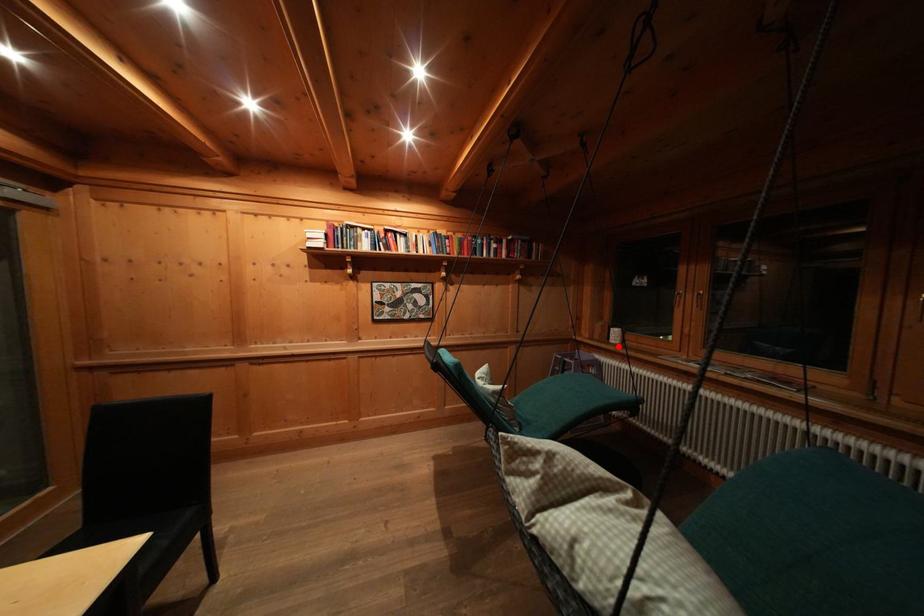
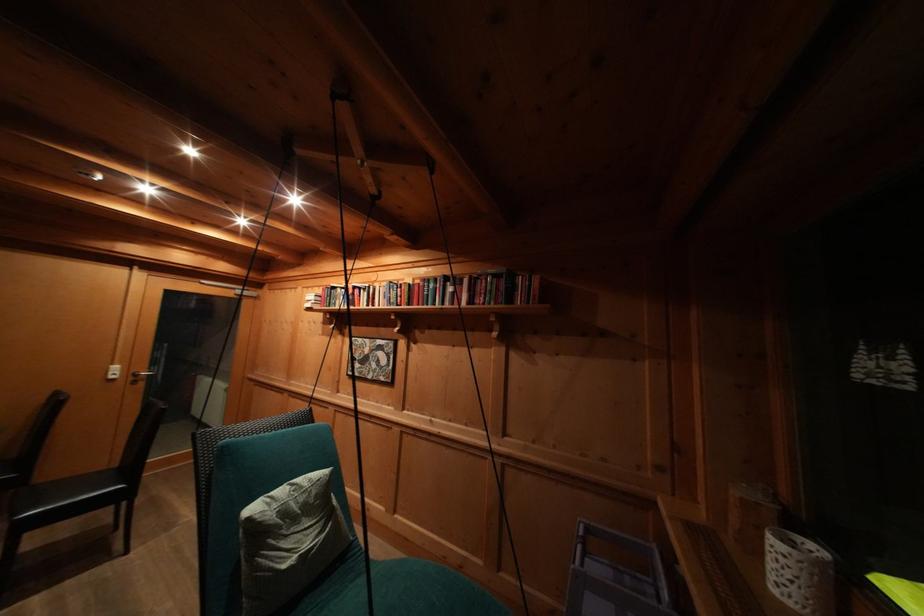
In the second image, find the point that corresponds to the highlighted location in the first image.

(780, 594)